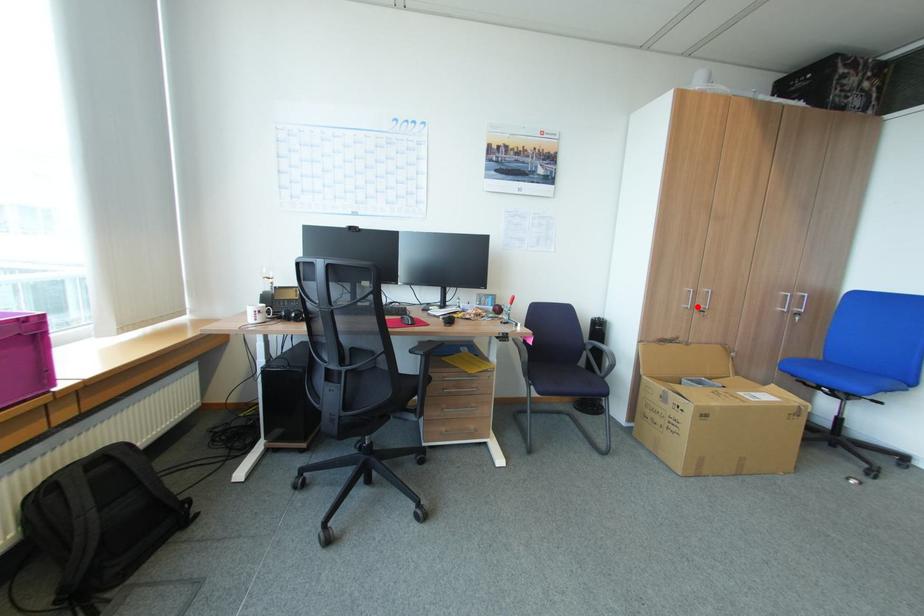
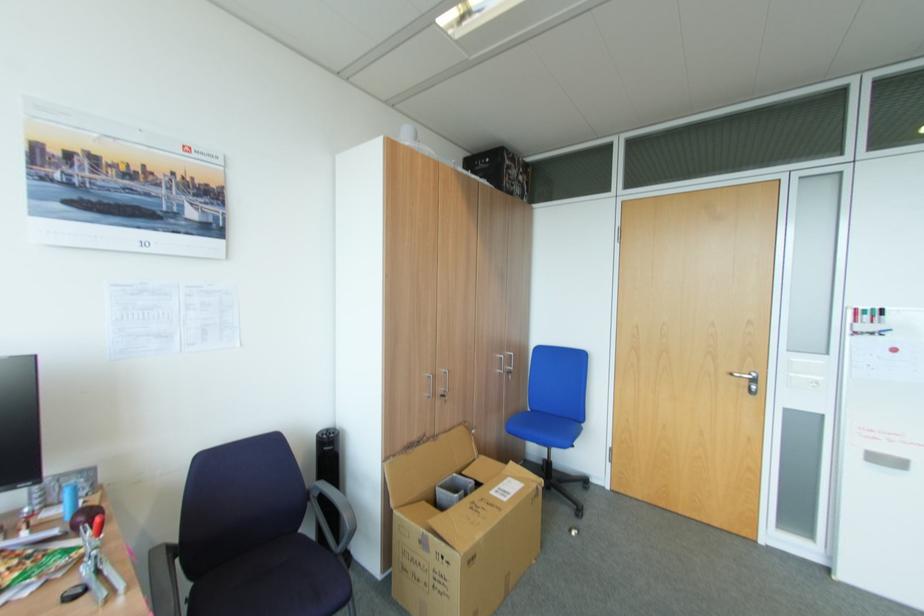
In the second image, find the point that corresponds to the highlighted location in the first image.

(440, 394)